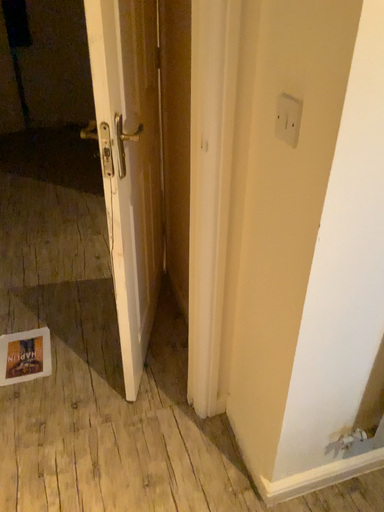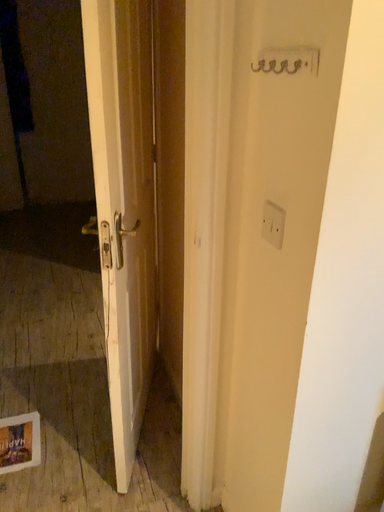
Question: How did the camera likely rotate when shooting the video?

Choices:
 (A) rotated upward
 (B) rotated downward

Answer: (A)